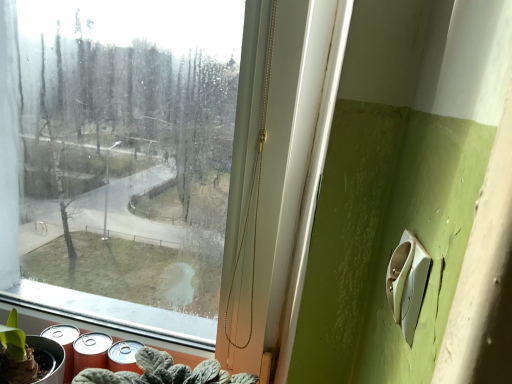
Question: From a real-world perspective, is green matte plant at lower left located beneath transparent glass window at center?

Choices:
 (A) yes
 (B) no

Answer: (A)

Question: From the image's perspective, is green matte plant at lower left under transparent glass window at center?

Choices:
 (A) no
 (B) yes

Answer: (B)

Question: From a real-world perspective, is green matte plant at lower left positioned over transparent glass window at center based on gravity?

Choices:
 (A) yes
 (B) no

Answer: (B)

Question: Considering the relative positions of green matte plant at lower left and transparent glass window at center in the image provided, is green matte plant at lower left behind transparent glass window at center?

Choices:
 (A) yes
 (B) no

Answer: (A)

Question: Is green matte plant at lower left oriented away from transparent glass window at center?

Choices:
 (A) yes
 (B) no

Answer: (A)

Question: In the image, is metallic silver spray can at lower left positioned in front of or behind transparent glass window at center?

Choices:
 (A) front
 (B) behind

Answer: (B)

Question: Is metallic silver spray can at lower left spatially inside transparent glass window at center, or outside of it?

Choices:
 (A) inside
 (B) outside

Answer: (A)

Question: In terms of height, does metallic silver spray can at lower left look taller or shorter compared to transparent glass window at center?

Choices:
 (A) tall
 (B) short

Answer: (B)

Question: From the image's perspective, is metallic silver spray can at lower left positioned above or below transparent glass window at center?

Choices:
 (A) above
 (B) below

Answer: (B)

Question: From a real-world perspective, relative to metallic silver spray can at lower left, is white plastic light switch at lower right vertically above or below?

Choices:
 (A) below
 (B) above

Answer: (B)

Question: Does point (396, 301) appear closer or farther from the camera than point (82, 344)?

Choices:
 (A) closer
 (B) farther

Answer: (A)

Question: Would you say white plastic light switch at lower right is to the left or to the right of metallic silver spray can at lower left in the picture?

Choices:
 (A) left
 (B) right

Answer: (B)

Question: Considering the positions of white plastic light switch at lower right and metallic silver spray can at lower left in the image, is white plastic light switch at lower right wider or thinner than metallic silver spray can at lower left?

Choices:
 (A) wide
 (B) thin

Answer: (B)

Question: Looking at their shapes, would you say metallic silver spray can at lower left is wider or thinner than white plastic light switch at lower right?

Choices:
 (A) thin
 (B) wide

Answer: (B)

Question: Does point (94, 347) appear closer or farther from the camera than point (428, 259)?

Choices:
 (A) closer
 (B) farther

Answer: (B)